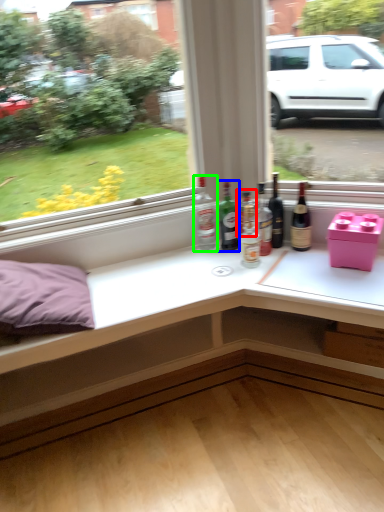
Question: Based on their relative distances, which object is farther from bottle (highlighted by a red box)? Choose from bottle (highlighted by a blue box) and bottle (highlighted by a green box).

Choices:
 (A) bottle
 (B) bottle

Answer: (B)